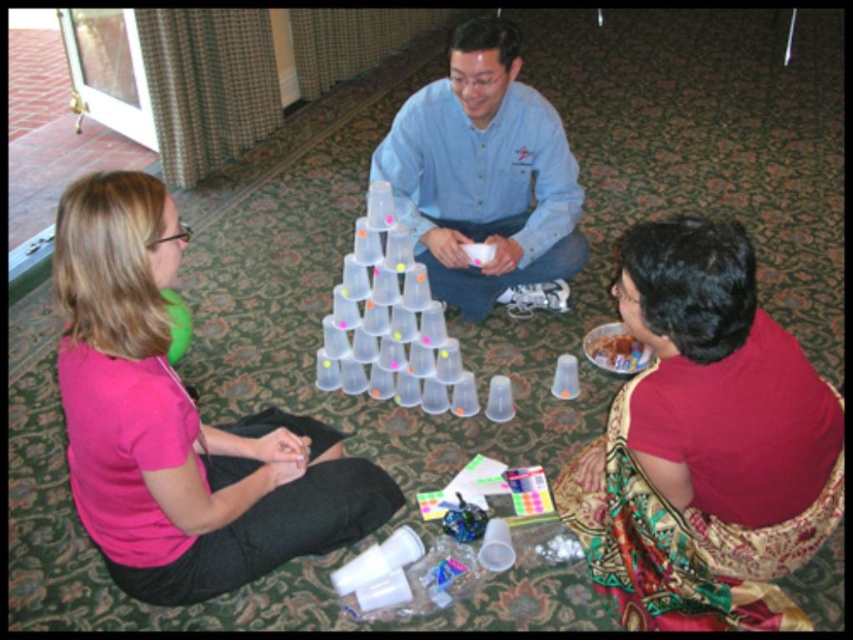
Question: Can you confirm if silky red saree at lower right is smaller than pink matte shirt at left?

Choices:
 (A) yes
 (B) no

Answer: (A)

Question: Which point is closer to the camera taking this photo?

Choices:
 (A) (471, 115)
 (B) (662, 252)

Answer: (B)

Question: Does pink matte shirt at left come in front of denim shirt at center?

Choices:
 (A) yes
 (B) no

Answer: (A)

Question: Can you confirm if pink matte shirt at left is thinner than denim shirt at center?

Choices:
 (A) no
 (B) yes

Answer: (B)

Question: Which object is the closest to the denim shirt at center?

Choices:
 (A) pink matte shirt at left
 (B) silky red saree at lower right

Answer: (B)

Question: Which point is closer to the camera?

Choices:
 (A) (543, 248)
 (B) (296, 512)
 (C) (733, 296)

Answer: (C)